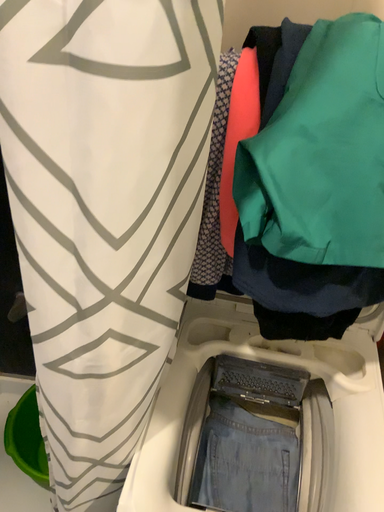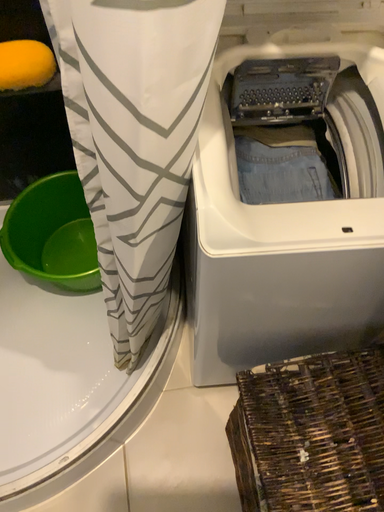
Question: How did the camera likely rotate when shooting the video?

Choices:
 (A) rotated right
 (B) rotated left

Answer: (A)